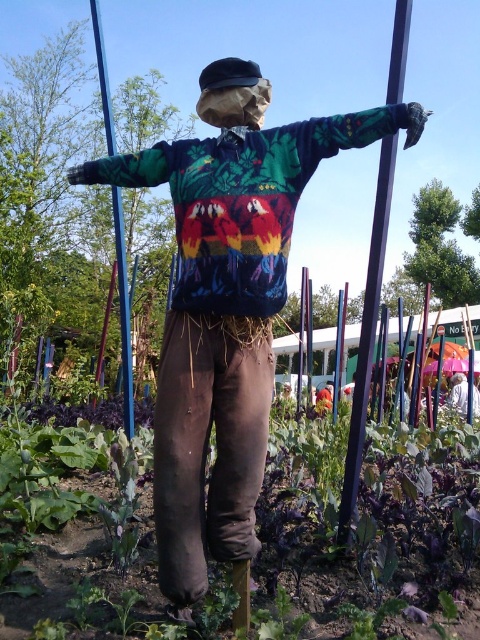
Question: Can you confirm if woolen sweater at center is positioned to the left of purple glossy pole at center?

Choices:
 (A) yes
 (B) no

Answer: (A)

Question: Which of the following is the closest to the observer?

Choices:
 (A) (467, 385)
 (B) (264, 260)
 (C) (319, 408)

Answer: (B)

Question: Can you confirm if purple glossy pole at center is positioned to the right of green plastic pole at center?

Choices:
 (A) no
 (B) yes

Answer: (B)

Question: Which of these objects is positioned closest to the purple glossy pole at center?

Choices:
 (A) woolen sweater at center
 (B) orange fabric shirt at center
 (C) white fabric umbrella at lower right
 (D) green plastic pole at center

Answer: (A)

Question: Does purple glossy pole at center appear under orange fabric shirt at center?

Choices:
 (A) yes
 (B) no

Answer: (B)

Question: Which of these objects is positioned farthest from the green plastic pole at center?

Choices:
 (A) white fabric umbrella at lower right
 (B) woolen sweater at center
 (C) purple glossy pole at center

Answer: (A)